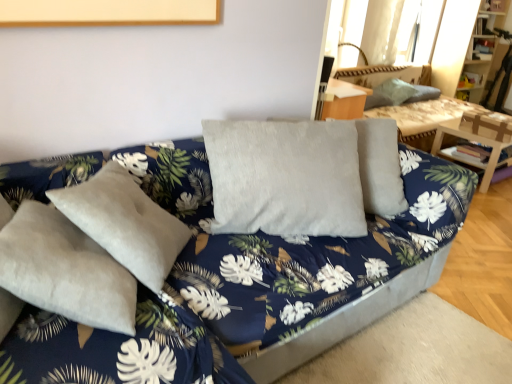
Question: From the image's perspective, is wooden table at right located above or below wooden bookshelf at upper right?

Choices:
 (A) below
 (B) above

Answer: (A)

Question: Is wooden table at right situated inside wooden bookshelf at upper right or outside?

Choices:
 (A) inside
 (B) outside

Answer: (B)

Question: Considering the real-world distances, which object is closest to the velvet green pillow at upper right?

Choices:
 (A) wooden bookshelf at upper right
 (B) translucent fabric curtain at upper right
 (C) velvet gray couch at center
 (D) velvet gray pillows at upper right
 (E) wooden table at right

Answer: (D)

Question: Which of these objects is positioned closest to the velvet gray couch at center?

Choices:
 (A) translucent fabric curtain at upper right
 (B) velvet gray pillows at upper right
 (C) wooden bookshelf at upper right
 (D) velvet green pillow at upper right
 (E) wooden table at right

Answer: (E)